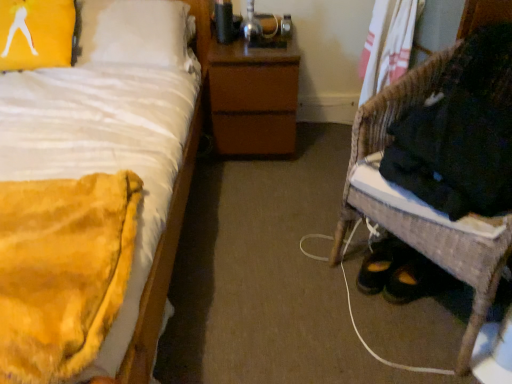
Question: Considering the relative positions of brown matte nightstand at center and woven wicker chair at lower right in the image provided, is brown matte nightstand at center behind woven wicker chair at lower right?

Choices:
 (A) no
 (B) yes

Answer: (B)

Question: From a real-world perspective, is brown matte nightstand at center beneath woven wicker chair at lower right?

Choices:
 (A) yes
 (B) no

Answer: (A)

Question: From a real-world perspective, is brown matte nightstand at center located higher than woven wicker chair at lower right?

Choices:
 (A) yes
 (B) no

Answer: (B)

Question: Does brown matte nightstand at center lie in front of woven wicker chair at lower right?

Choices:
 (A) no
 (B) yes

Answer: (A)

Question: Is brown matte nightstand at center positioned with its back to woven wicker chair at lower right?

Choices:
 (A) no
 (B) yes

Answer: (A)

Question: In terms of width, does woven wicker chair at lower right look wider or thinner when compared to yellow plush blanket at left?

Choices:
 (A) thin
 (B) wide

Answer: (A)

Question: From a real-world perspective, is woven wicker chair at lower right physically located above or below yellow plush blanket at left?

Choices:
 (A) above
 (B) below

Answer: (B)

Question: Choose the correct answer: Is woven wicker chair at lower right inside yellow plush blanket at left or outside it?

Choices:
 (A) outside
 (B) inside

Answer: (A)

Question: Does point (423, 236) appear closer or farther from the camera than point (6, 129)?

Choices:
 (A) farther
 (B) closer

Answer: (B)

Question: Based on their positions, is yellow plush blanket at left located to the left or right of yellow fabric pillow at upper left?

Choices:
 (A) right
 (B) left

Answer: (A)

Question: From their relative heights in the image, would you say yellow plush blanket at left is taller or shorter than yellow fabric pillow at upper left?

Choices:
 (A) short
 (B) tall

Answer: (B)

Question: Based on their sizes in the image, would you say yellow plush blanket at left is bigger or smaller than yellow fabric pillow at upper left?

Choices:
 (A) small
 (B) big

Answer: (B)

Question: Would you say yellow plush blanket at left is inside or outside yellow fabric pillow at upper left?

Choices:
 (A) inside
 (B) outside

Answer: (B)

Question: From the image's perspective, is woven wicker chair at lower right located above or below yellow fabric pillow at upper left?

Choices:
 (A) above
 (B) below

Answer: (B)

Question: Is woven wicker chair at lower right inside the boundaries of yellow fabric pillow at upper left, or outside?

Choices:
 (A) outside
 (B) inside

Answer: (A)